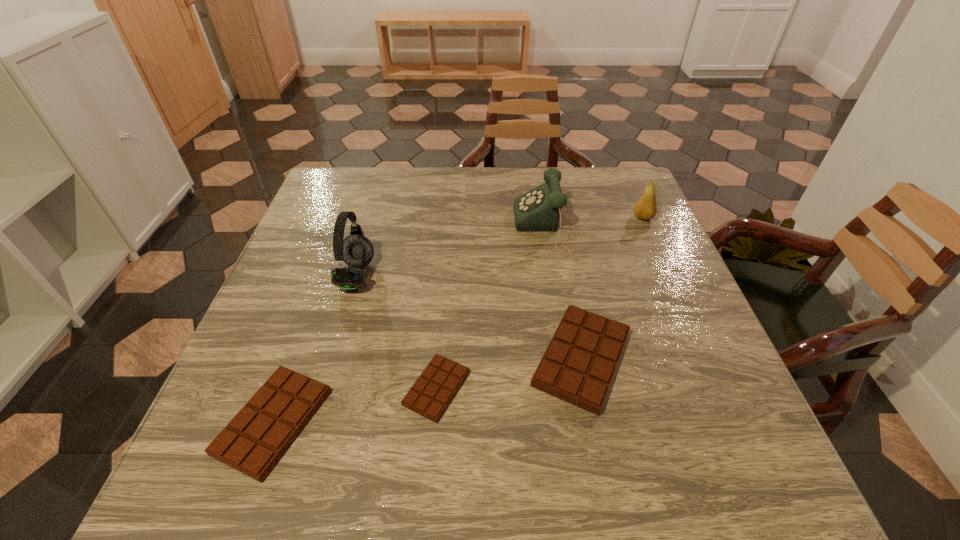
The width and height of the screenshot is (960, 540). I want to click on free space located on the right of the rightmost candy bar, so click(x=712, y=359).

In order to click on blank area located 0.110m on the dial of the telephone in this screenshot , I will do `click(474, 228)`.

The image size is (960, 540). I want to click on blank space located 0.260m on the dial of the telephone, so click(418, 228).

Identify the location of vacant space situated 0.370m on the dial of the telephone. This screenshot has width=960, height=540. pyautogui.click(x=375, y=228).

Find the location of a particular element. Image resolution: width=960 pixels, height=540 pixels. vacant point located 0.280m on the ear cups of the tallest object is located at coordinates (492, 276).

Locate an element on the screen. blank space located on the left of the pear is located at coordinates (588, 217).

At what (x,y) coordinates should I click in order to perform the action: click on telephone that is at the far edge. Please return your answer as a coordinate pair (x, y). This screenshot has width=960, height=540. Looking at the image, I should click on (539, 209).

The image size is (960, 540). Find the location of `pear present at the far edge`. pear present at the far edge is located at coordinates (645, 208).

In order to click on candy bar present at the left edge in this screenshot , I will do `click(253, 442)`.

Identify the location of headset that is at the left edge. (356, 250).